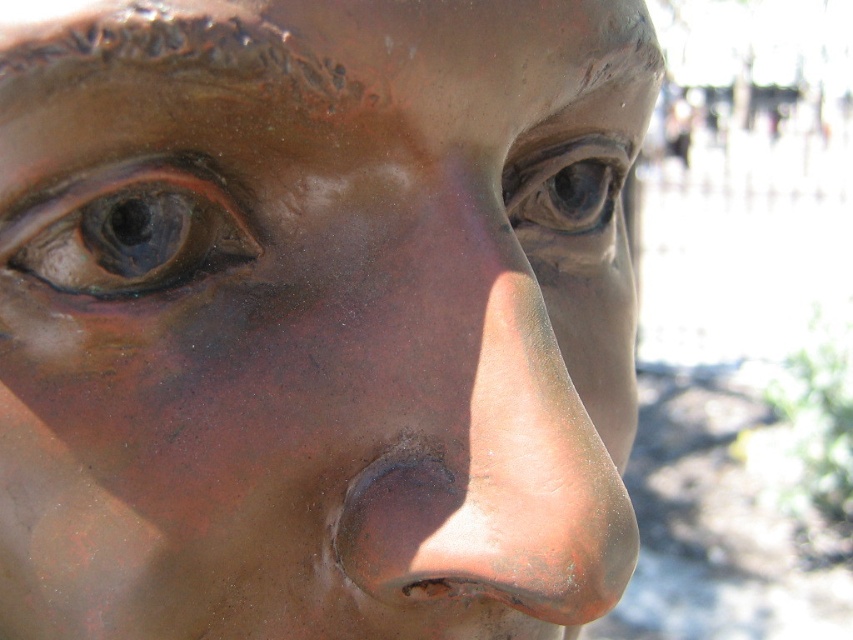
Question: Which is nearer to the matte bronze eye at center?

Choices:
 (A) shiny bronze eye at upper left
 (B) bronze textured nose at center

Answer: (B)

Question: Is the position of bronze textured nose at center more distant than that of shiny bronze eye at upper left?

Choices:
 (A) yes
 (B) no

Answer: (B)

Question: Which of the following is the farthest from the observer?

Choices:
 (A) coord(164,200)
 (B) coord(480,365)

Answer: (A)

Question: Does shiny bronze eye at upper left have a greater width compared to matte bronze eye at center?

Choices:
 (A) no
 (B) yes

Answer: (A)

Question: Which of the following is the closest to the observer?

Choices:
 (A) (526, 221)
 (B) (577, 438)

Answer: (B)

Question: Is shiny bronze eye at upper left closer to the viewer compared to matte bronze eye at center?

Choices:
 (A) no
 (B) yes

Answer: (B)